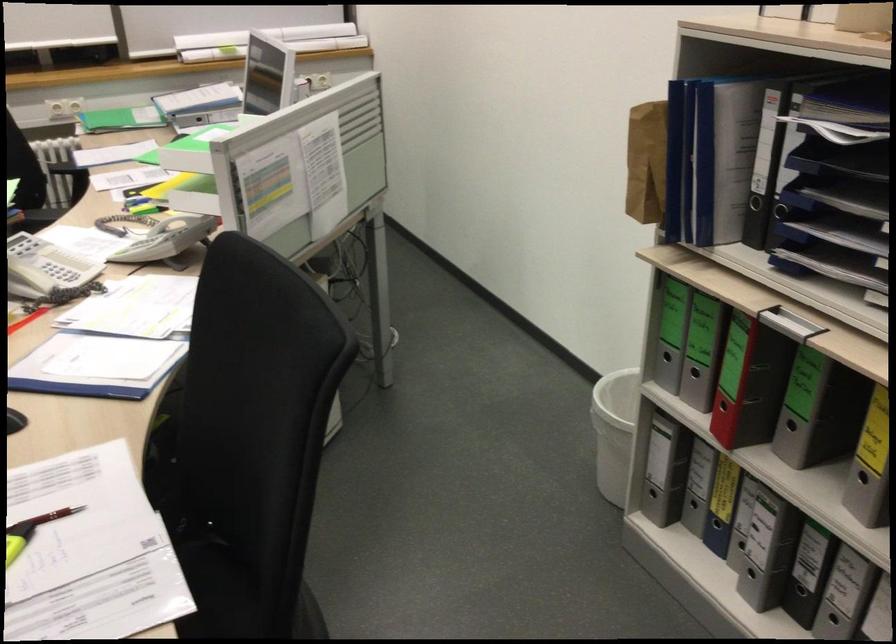
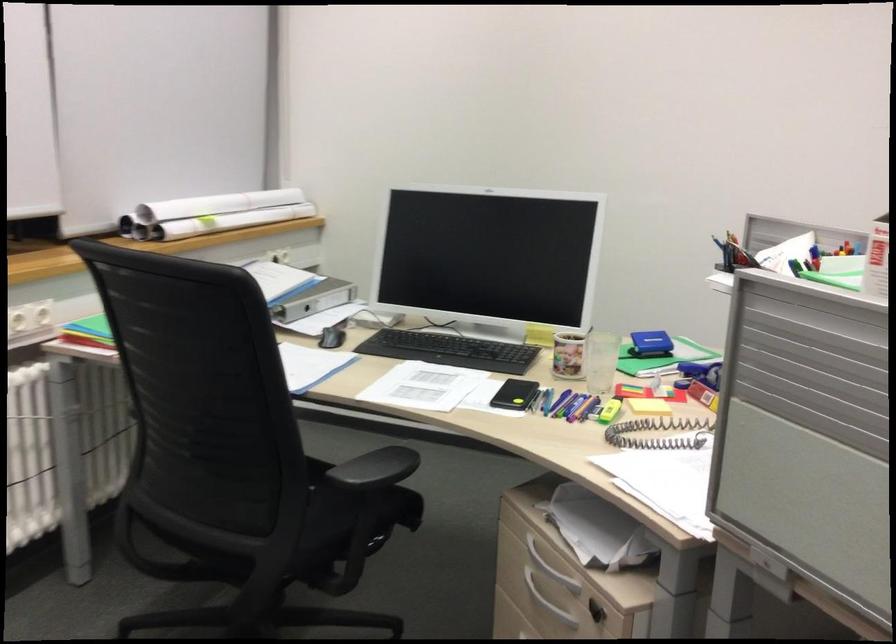
Locate, in the second image, the point that corresponds to [142,205] in the first image.

(565, 404)